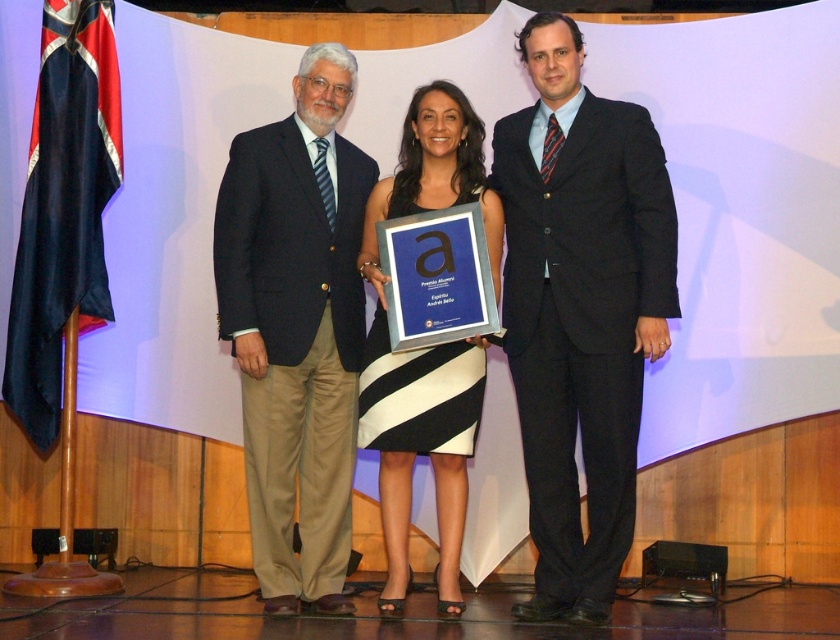
Question: Estimate the real-world distances between objects in this image. Which object is farther from the black suit at center?

Choices:
 (A) black silk flag at left
 (B) dark blue suit at left

Answer: (A)

Question: Can you confirm if dark blue suit at left is positioned to the right of black silk flag at left?

Choices:
 (A) yes
 (B) no

Answer: (A)

Question: Which of the following is the closest to the observer?

Choices:
 (A) black suit at center
 (B) black and white striped dress at center
 (C) dark blue suit at left
 (D) black silk flag at left

Answer: (A)

Question: Does black and white striped dress at center appear on the left side of black silk flag at left?

Choices:
 (A) yes
 (B) no

Answer: (B)

Question: Can you confirm if black suit at center is positioned to the left of dark blue suit at left?

Choices:
 (A) no
 (B) yes

Answer: (A)

Question: Which point is closer to the camera?

Choices:
 (A) black silk flag at left
 (B) dark blue suit at left
 (C) black suit at center

Answer: (C)